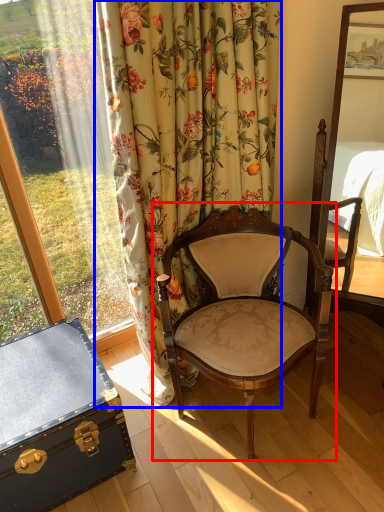
Question: Among these objects, which one is nearest to the camera, chair (highlighted by a red box) or curtain (highlighted by a blue box)?

Choices:
 (A) chair
 (B) curtain

Answer: (B)